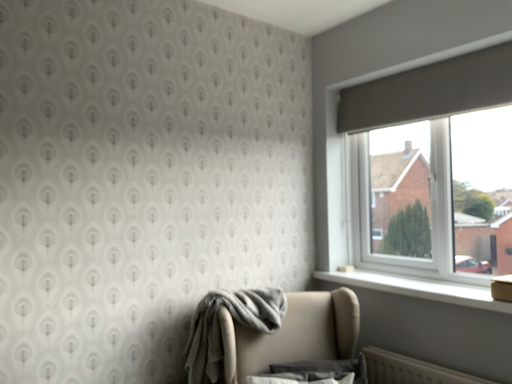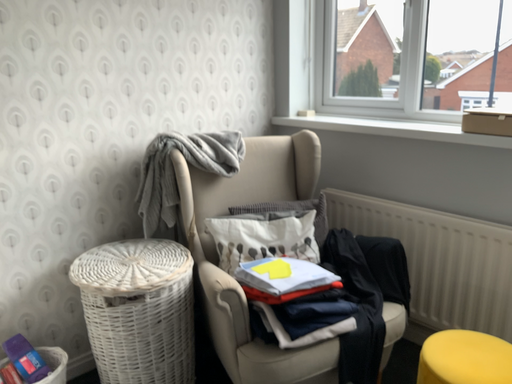
Question: How did the camera likely rotate when shooting the video?

Choices:
 (A) rotated downward
 (B) rotated upward

Answer: (A)